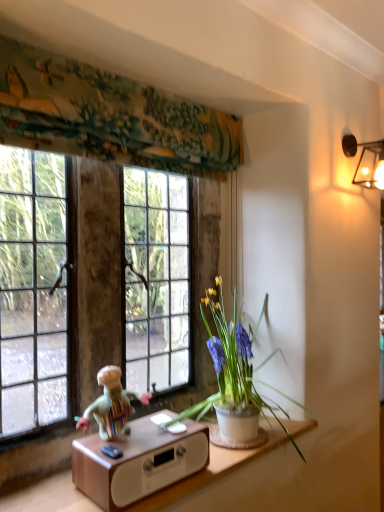
Question: Is metallic wall sconce at upper right to the left of textured fabric at upper center from the viewer's perspective?

Choices:
 (A) no
 (B) yes

Answer: (A)

Question: Is metallic wall sconce at upper right wider than textured fabric at upper center?

Choices:
 (A) no
 (B) yes

Answer: (B)

Question: Is metallic wall sconce at upper right not close to textured fabric at upper center?

Choices:
 (A) no
 (B) yes

Answer: (A)

Question: Is metallic wall sconce at upper right taller than textured fabric at upper center?

Choices:
 (A) yes
 (B) no

Answer: (B)

Question: Is metallic wall sconce at upper right aimed at textured fabric at upper center?

Choices:
 (A) no
 (B) yes

Answer: (A)

Question: Is white ceramic pot at center spatially inside multicolored fabric doll at lower center, or outside of it?

Choices:
 (A) outside
 (B) inside

Answer: (A)

Question: In terms of height, does white ceramic pot at center look taller or shorter compared to multicolored fabric doll at lower center?

Choices:
 (A) short
 (B) tall

Answer: (B)

Question: Based on their sizes in the image, would you say white ceramic pot at center is bigger or smaller than multicolored fabric doll at lower center?

Choices:
 (A) small
 (B) big

Answer: (B)

Question: Is point (215, 305) closer or farther from the camera than point (125, 398)?

Choices:
 (A) closer
 (B) farther

Answer: (B)

Question: Is multicolored fabric doll at lower center inside or outside of white ceramic pot at center?

Choices:
 (A) inside
 (B) outside

Answer: (B)

Question: In terms of size, does multicolored fabric doll at lower center appear bigger or smaller than white ceramic pot at center?

Choices:
 (A) small
 (B) big

Answer: (A)

Question: Looking at their shapes, would you say multicolored fabric doll at lower center is wider or thinner than white ceramic pot at center?

Choices:
 (A) wide
 (B) thin

Answer: (B)

Question: From a real-world perspective, is multicolored fabric doll at lower center physically located above or below white ceramic pot at center?

Choices:
 (A) above
 (B) below

Answer: (B)

Question: Is point (208, 298) closer or farther from the camera than point (132, 96)?

Choices:
 (A) farther
 (B) closer

Answer: (A)

Question: Considering the positions of white ceramic pot at center and textured fabric at upper center in the image, is white ceramic pot at center bigger or smaller than textured fabric at upper center?

Choices:
 (A) small
 (B) big

Answer: (B)